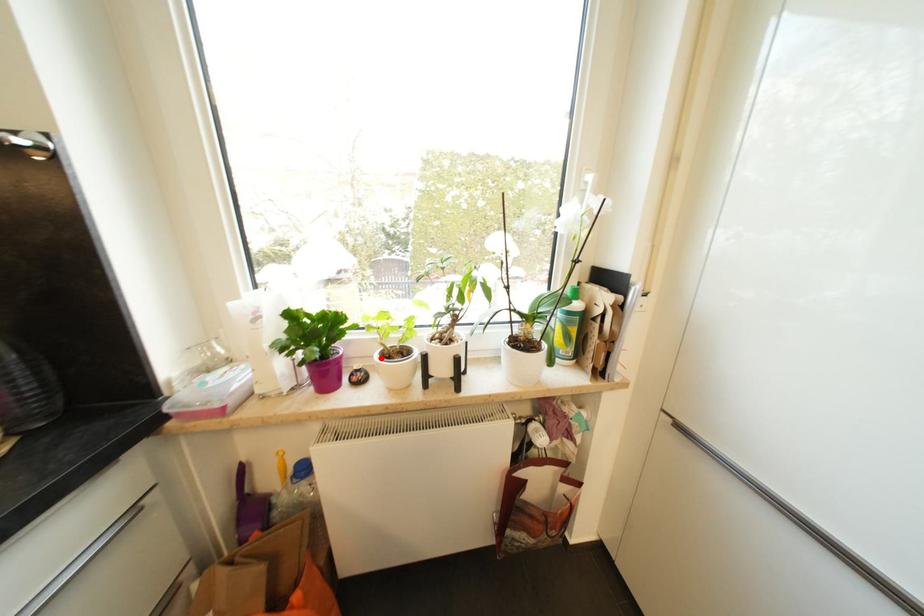
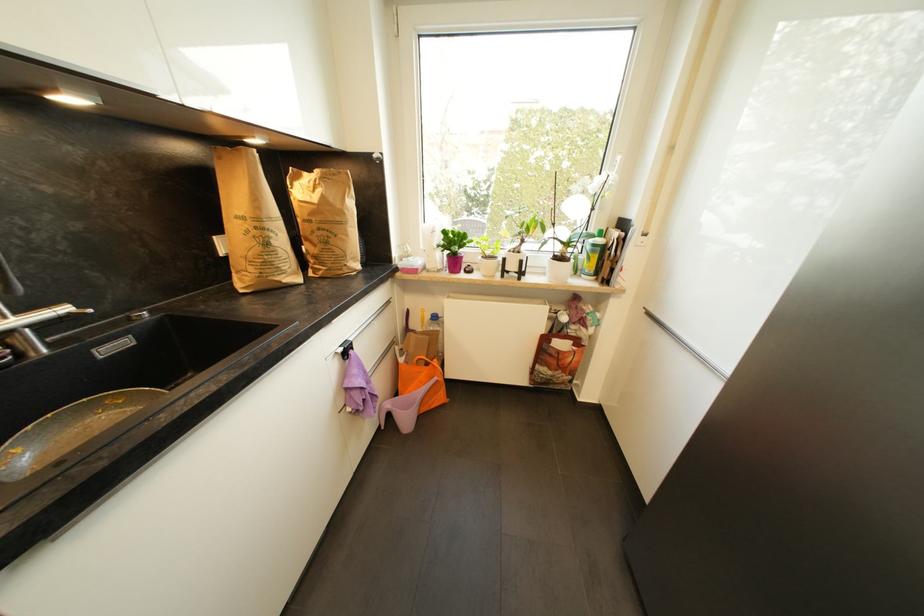
Where in the second image is the point corresponding to the highlighted location from the first image?

(484, 259)